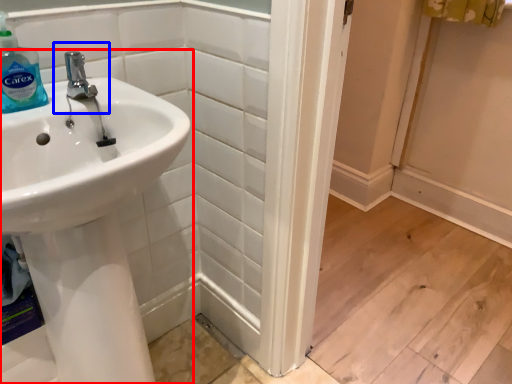
Question: Among these objects, which one is nearest to the camera, sink (highlighted by a red box) or plumbing fixture (highlighted by a blue box)?

Choices:
 (A) sink
 (B) plumbing fixture

Answer: (A)